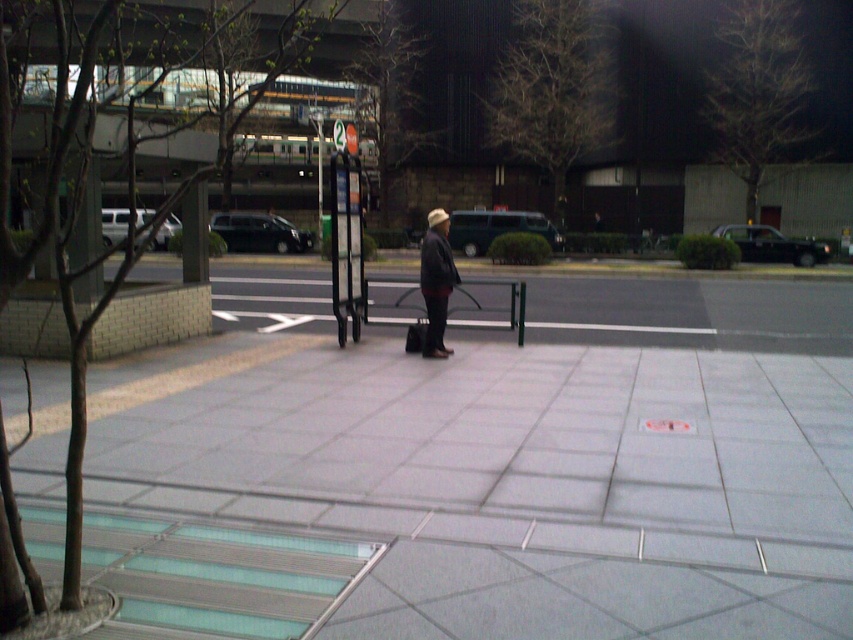
Question: Which point appears closest to the camera in this image?

Choices:
 (A) (432, 291)
 (B) (677, 403)

Answer: (B)

Question: Which object appears closest to the camera in this image?

Choices:
 (A) gray tile pavement at center
 (B) dark gray fabric jacket at center

Answer: (A)

Question: Does gray tile pavement at center have a larger size compared to dark gray fabric jacket at center?

Choices:
 (A) no
 (B) yes

Answer: (A)

Question: Can you confirm if gray tile pavement at center is wider than dark gray fabric jacket at center?

Choices:
 (A) yes
 (B) no

Answer: (A)

Question: Which of the following is the closest to the observer?

Choices:
 (A) gray tile pavement at center
 (B) dark gray fabric jacket at center

Answer: (A)

Question: Observing the image, what is the correct spatial positioning of gray tile pavement at center in reference to dark gray fabric jacket at center?

Choices:
 (A) above
 (B) below

Answer: (B)